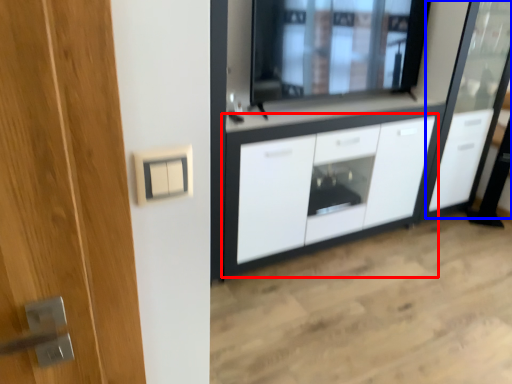
Question: Which object appears farthest to the camera in this image, cabinetry (highlighted by a red box) or screen door (highlighted by a blue box)?

Choices:
 (A) cabinetry
 (B) screen door

Answer: (B)